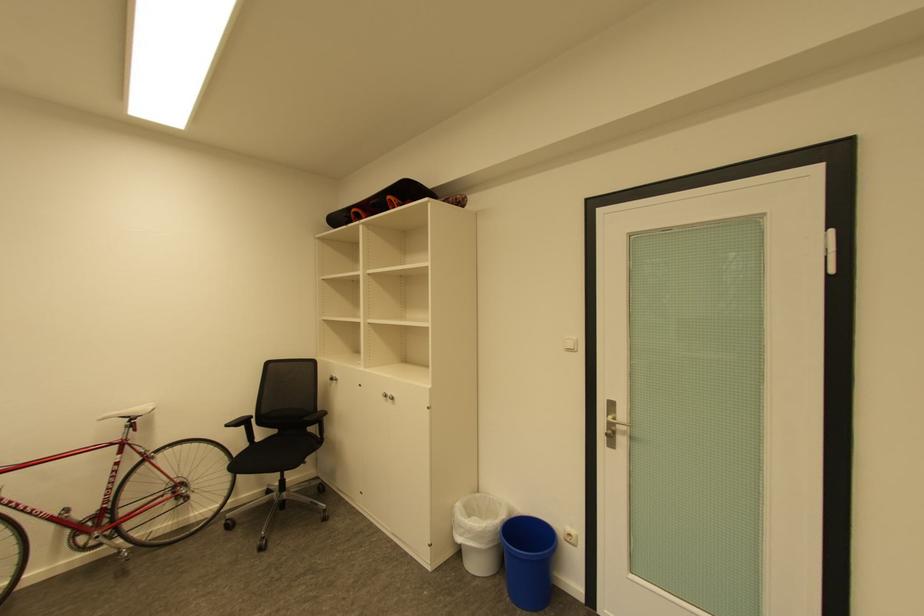
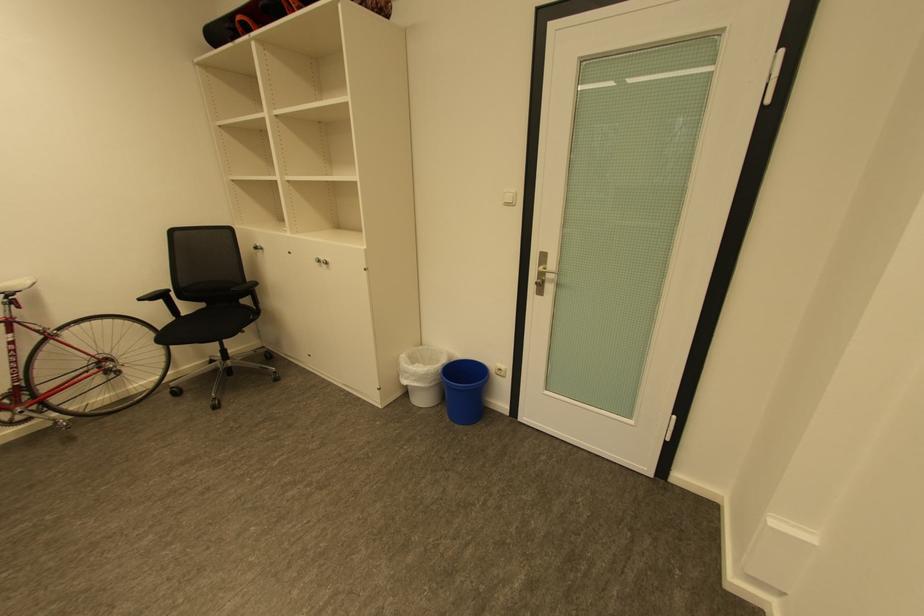
Find the pixel in the second image that matches point (338, 379) in the first image.

(262, 248)